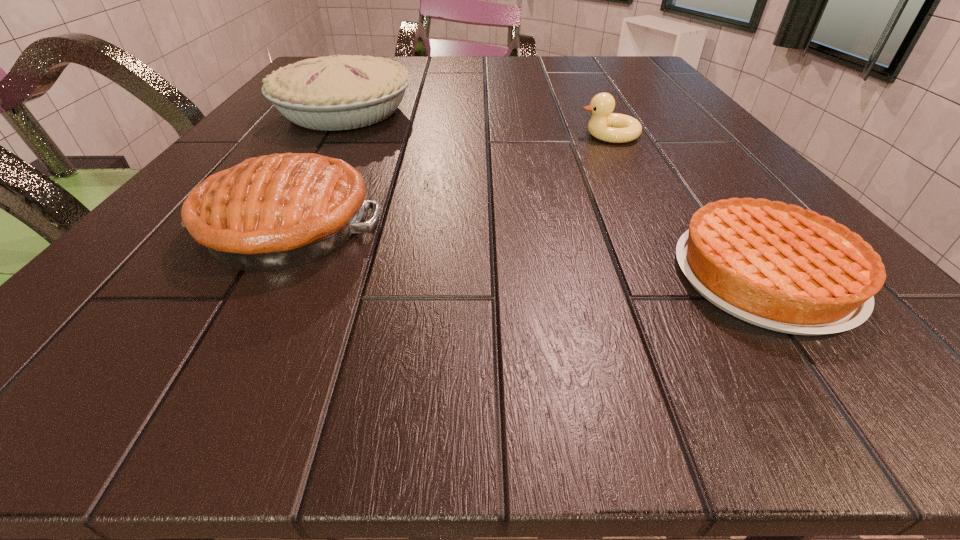
Where is `unoccupied position between the shortest object and the farthest pie`? This screenshot has width=960, height=540. unoccupied position between the shortest object and the farthest pie is located at coordinates (555, 193).

Locate an element on the screen. free area in between the shortest object and the second shortest object is located at coordinates (687, 205).

In order to click on object that is the closest to the farthest pie in this screenshot , I will do tap(274, 212).

Identify which object is located as the nearest to the farthest pie. Please provide its 2D coordinates. Your answer should be formatted as a tuple, i.e. [(x, y)], where the tuple contains the x and y coordinates of a point satisfying the conditions above.

[(274, 212)]

Image resolution: width=960 pixels, height=540 pixels. What are the coordinates of `pie that is the second nearest to the shortest pie` in the screenshot? It's located at (341, 92).

Identify which pie is the closest to the shortest object. Please provide its 2D coordinates. Your answer should be formatted as a tuple, i.e. [(x, y)], where the tuple contains the x and y coordinates of a point satisfying the conditions above.

[(274, 212)]

I want to click on vacant space that satisfies the following two spatial constraints: 1. at the beak of the shortest object; 2. on the left side of the second shortest object, so click(684, 275).